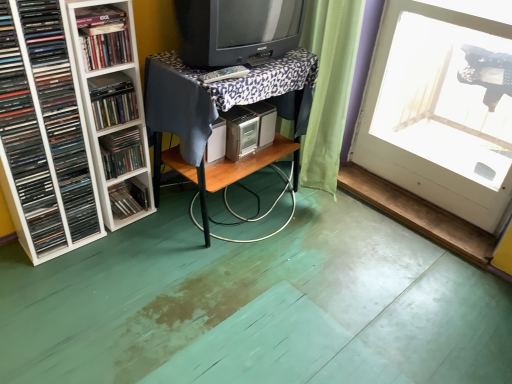
What do you see at coordinates (236, 29) in the screenshot? Image resolution: width=512 pixels, height=384 pixels. I see `matte black television at center` at bounding box center [236, 29].

Where is `wooden table at center, marked as the first table in a bottom-to-top arrangement`? The height and width of the screenshot is (384, 512). wooden table at center, marked as the first table in a bottom-to-top arrangement is located at coordinates (228, 177).

I want to click on white plastic shelf at left, the 3th book positioned from the bottom, so click(x=44, y=132).

Where is `matte black cd at left, which is the fourth book in bottom-to-top order`? The width and height of the screenshot is (512, 384). matte black cd at left, which is the fourth book in bottom-to-top order is located at coordinates (112, 99).

Do you think wooden table at center, which is the second table from bottom to top, is within matte black cd case at lower left, the 5th book from the top, or outside of it?

The correct answer is: outside.

Which of these two, wooden table at center, the 1th table viewed from the top, or matte black cd case at lower left, positioned as the first book in bottom-to-top order, is thinner?

Result: Thinner between the two is matte black cd case at lower left, positioned as the first book in bottom-to-top order.

Can matte black book at upper left, which ranks as the 5th book in bottom-to-top order, be found inside white plastic shelf at left, the 3th book positioned from the bottom?

No.

In the image, is white plastic shelf at left, which appears as the 3th book when viewed from the top, positioned in front of or behind matte black book at upper left, which ranks as the 5th book in bottom-to-top order?

In the image, white plastic shelf at left, which appears as the 3th book when viewed from the top, appears in front of matte black book at upper left, which ranks as the 5th book in bottom-to-top order.

Which object is thinner, white plastic shelf at left, which appears as the 3th book when viewed from the top, or matte black book at upper left, which ranks as the 5th book in bottom-to-top order?

With smaller width is matte black book at upper left, which ranks as the 5th book in bottom-to-top order.

From the image's perspective, is white plastic shelf at left, which appears as the 3th book when viewed from the top, located beneath matte black book at upper left, which ranks as the 5th book in bottom-to-top order?

Indeed, from the image's perspective, white plastic shelf at left, which appears as the 3th book when viewed from the top, is shown beneath matte black book at upper left, which ranks as the 5th book in bottom-to-top order.

Considering the positions of objects matte black cd case at lower left, the 5th book from the top, and matte plastic books at left, the second book positioned from the bottom, in the image provided, who is in front, matte black cd case at lower left, the 5th book from the top, or matte plastic books at left, the second book positioned from the bottom,?

Positioned in front is matte plastic books at left, the second book positioned from the bottom.

Is matte black cd case at lower left, the 5th book from the top, wider than matte plastic books at left, which is the fourth book in top-to-bottom order?

No.

From the image's perspective, between matte black cd case at lower left, the 5th book from the top, and matte plastic books at left, which is the fourth book in top-to-bottom order, who is located below?

matte black cd case at lower left, the 5th book from the top, is shown below in the image.

Considering the relative sizes of matte black cd case at lower left, the 5th book from the top, and white plastic shelf at left in the image provided, is matte black cd case at lower left, the 5th book from the top, taller than white plastic shelf at left?

No.

From the image's perspective, who appears lower, matte black cd case at lower left, positioned as the first book in bottom-to-top order, or white plastic shelf at left?

From the image's view, matte black cd case at lower left, positioned as the first book in bottom-to-top order, is below.

In terms of width, does matte black cd case at lower left, the 5th book from the top, look wider or thinner when compared to white plastic shelf at left?

matte black cd case at lower left, the 5th book from the top, is thinner than white plastic shelf at left.

Considering the positions of objects matte black cd case at lower left, the 5th book from the top, and white plastic shelf at left in the image provided, who is more to the left, matte black cd case at lower left, the 5th book from the top, or white plastic shelf at left?

From the viewer's perspective, matte black cd case at lower left, the 5th book from the top, appears more on the left side.

Is white plastic shelf at left at the back of matte black cd at left, positioned as the 2th book in top-to-bottom order?

Correct, matte black cd at left, positioned as the 2th book in top-to-bottom order, is looking away from white plastic shelf at left.

Based on their sizes in the image, would you say matte black cd at left, which is the fourth book in bottom-to-top order, is bigger or smaller than white plastic shelf at left?

Clearly, matte black cd at left, which is the fourth book in bottom-to-top order, is smaller in size than white plastic shelf at left.

From the image's perspective, which is below, matte black cd at left, positioned as the 2th book in top-to-bottom order, or white plastic shelf at left?

From the image's view, white plastic shelf at left is below.

This screenshot has height=384, width=512. Identify the location of the 1st book to the left of the white plastic shelf at left, counting from the anchor's position. tap(112, 99).

Who is smaller, matte black television at center or matte black cd case at lower left, positioned as the first book in bottom-to-top order?

With smaller size is matte black cd case at lower left, positioned as the first book in bottom-to-top order.

Is matte black television at center positioned behind matte black cd case at lower left, the 5th book from the top?

No, the depth of matte black television at center is less than that of matte black cd case at lower left, the 5th book from the top.

Does point (276, 42) come behind point (120, 206)?

That is False.

Measure the distance from matte black television at center to matte black cd case at lower left, the 5th book from the top.

matte black television at center and matte black cd case at lower left, the 5th book from the top, are 32.53 inches apart.

Between matte black cd case at lower left, the 5th book from the top, and white plastic shelf at left, the 3th book positioned from the bottom, which one has less height?

With less height is matte black cd case at lower left, the 5th book from the top.

Would you say matte black cd case at lower left, positioned as the first book in bottom-to-top order, is inside or outside white plastic shelf at left, which appears as the 3th book when viewed from the top?

matte black cd case at lower left, positioned as the first book in bottom-to-top order, is spatially situated outside white plastic shelf at left, which appears as the 3th book when viewed from the top.

From a real-world perspective, count 2nd books downward from the wooden table at center, which is the second table from bottom to top, and point to it. Please provide its 2D coordinates.

[(128, 198)]

From a real-world perspective, which book is the 2nd one above the white plastic shelf at left, which appears as the 3th book when viewed from the top? Please provide its 2D coordinates.

[(104, 36)]

Considering their positions, is white plastic shelf at left positioned closer to matte black cd at left, positioned as the 2th book in top-to-bottom order, than white plastic shelf at left, which appears as the 3th book when viewed from the top?

white plastic shelf at left lies closer to matte black cd at left, positioned as the 2th book in top-to-bottom order, than the other object.

Based on their spatial positions, is matte black television at center or matte black cd at left, which is the fourth book in bottom-to-top order, closer to white glossy door at upper right?

matte black television at center.

When comparing their distances from white glossy door at upper right, does matte plastic books at left, which is the fourth book in top-to-bottom order, or matte black book at upper left, which is counted as the 1th book, starting from the top, seem closer?

Among the two, matte plastic books at left, which is the fourth book in top-to-bottom order, is located nearer to white glossy door at upper right.

Considering their positions, is white glossy door at upper right positioned closer to matte black book at upper left, which ranks as the 5th book in bottom-to-top order, than matte black cd at left, positioned as the 2th book in top-to-bottom order?

The object closer to matte black book at upper left, which ranks as the 5th book in bottom-to-top order, is matte black cd at left, positioned as the 2th book in top-to-bottom order.

Considering their positions, is wooden table at center, marked as the first table in a bottom-to-top arrangement, positioned closer to matte black television at center than matte black book at upper left, which ranks as the 5th book in bottom-to-top order?

matte black book at upper left, which ranks as the 5th book in bottom-to-top order, lies closer to matte black television at center than the other object.

Looking at the image, which one is located further to matte black television at center, matte black book at upper left, which ranks as the 5th book in bottom-to-top order, or wooden table at center, positioned as the second table in top-to-bottom order?

wooden table at center, positioned as the second table in top-to-bottom order, lies further to matte black television at center than the other object.

Estimate the real-world distances between objects in this image. Which object is further from wooden table at center, positioned as the second table in top-to-bottom order, matte black cd case at lower left, the 5th book from the top, or matte black television at center?

Among the two, matte black television at center is located further to wooden table at center, positioned as the second table in top-to-bottom order.

When comparing their distances from matte black book at upper left, which ranks as the 5th book in bottom-to-top order, does matte black cd at left, which is the fourth book in bottom-to-top order, or white plastic shelf at left seem closer?

Based on the image, matte black cd at left, which is the fourth book in bottom-to-top order, appears to be nearer to matte black book at upper left, which ranks as the 5th book in bottom-to-top order.

In order to click on book located between matte black cd at left, which is the fourth book in bottom-to-top order, and matte black television at center in the left-right direction in this screenshot , I will do `click(104, 36)`.

In order to click on shelf between white plastic shelf at left, the 3th book positioned from the bottom, and wooden table at center, the 1th table viewed from the top in this screenshot , I will do `click(113, 107)`.

Where is `shelf between matte black cd case at lower left, the 5th book from the top, and white glossy door at upper right`? The width and height of the screenshot is (512, 384). shelf between matte black cd case at lower left, the 5th book from the top, and white glossy door at upper right is located at coordinates (113, 107).

You are a GUI agent. You are given a task and a screenshot of the screen. Output one action in this format:
    pyautogui.click(x=<x>, y=<y>)
    Task: Click on the table located between matte black television at center and white glossy door at upper right in the left-right direction
    The height and width of the screenshot is (384, 512).
    Given the screenshot: What is the action you would take?
    pyautogui.click(x=228, y=177)